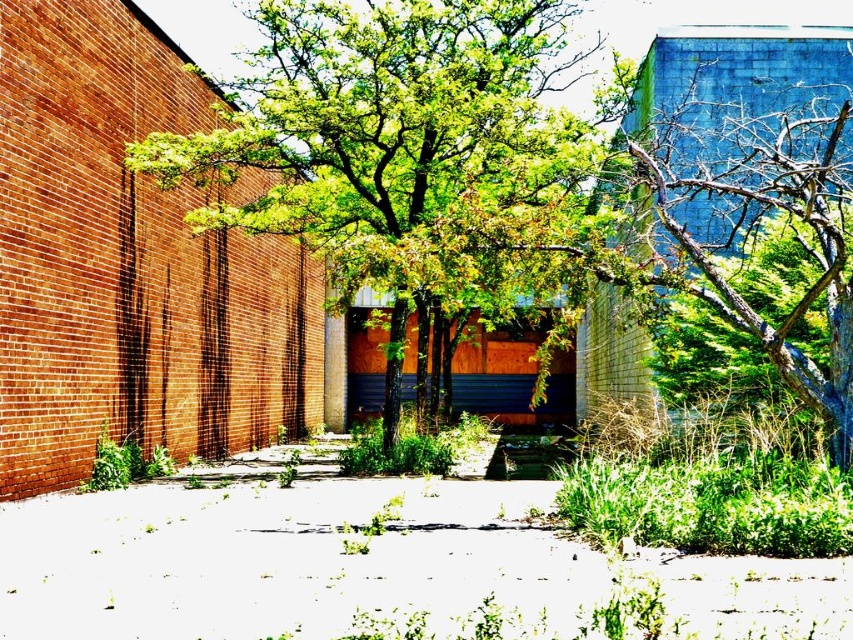
You are standing in front of the green leafy tree at center and looking towards the white gravel at center. Which object is closer to you?

The green leafy tree at center is closer to you because it is in front of the white gravel at center.

Consider the image. Based on the coordinates provided, which object is located at point (408,150)?

The point (408,150) indicates the location of the green leafy tree at center.

You are standing in the urban scene and want to take a photo of the green leafy tree at center. If your camera has a grid overlay that shows coordinates, where should you aim your camera to capture the tree?

You should aim your camera at the coordinates point (408, 150) to capture the green leafy tree at center.